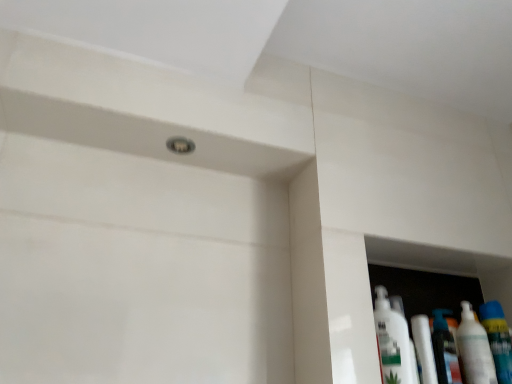
Question: Can you confirm if white glossy tube at lower right is bigger than white glossy bottle at right, the 2th cleaning product viewed from the left?

Choices:
 (A) yes
 (B) no

Answer: (B)

Question: Is white glossy tube at lower right not near white glossy bottle at right, the 2th cleaning product viewed from the left?

Choices:
 (A) no
 (B) yes

Answer: (A)

Question: Does white glossy tube at lower right have a greater height compared to white glossy bottle at right, the 2th cleaning product viewed from the left?

Choices:
 (A) no
 (B) yes

Answer: (A)

Question: From a real-world perspective, is white glossy tube at lower right physically above white glossy bottle at right, the 1th cleaning product when ordered from right to left?

Choices:
 (A) no
 (B) yes

Answer: (A)

Question: From the image's perspective, is white glossy tube at lower right above white glossy bottle at right, the 1th cleaning product when ordered from right to left?

Choices:
 (A) no
 (B) yes

Answer: (B)

Question: Visually, is white glossy bottle at right, the 1th cleaning product when ordered from right to left, positioned to the left or to the right of translucent plastic mouthwash at right, placed as the first mouthwash when sorted from right to left?

Choices:
 (A) right
 (B) left

Answer: (B)

Question: In terms of height, does white glossy bottle at right, the 2th cleaning product viewed from the left, look taller or shorter compared to translucent plastic mouthwash at right, placed as the first mouthwash when sorted from right to left?

Choices:
 (A) tall
 (B) short

Answer: (A)

Question: Is white glossy bottle at right, the 1th cleaning product when ordered from right to left, wider or thinner than translucent plastic mouthwash at right, placed as the first mouthwash when sorted from right to left?

Choices:
 (A) thin
 (B) wide

Answer: (A)

Question: From a real-world perspective, is white glossy bottle at right, the 2th cleaning product viewed from the left, physically located above or below translucent plastic mouthwash at right, placed as the first mouthwash when sorted from right to left?

Choices:
 (A) below
 (B) above

Answer: (A)

Question: In terms of width, does translucent plastic mouthwash at right, the second mouthwash positioned from the left, look wider or thinner when compared to white glossy tube at lower right?

Choices:
 (A) thin
 (B) wide

Answer: (B)

Question: From the image's perspective, is translucent plastic mouthwash at right, the second mouthwash positioned from the left, located above or below white glossy tube at lower right?

Choices:
 (A) below
 (B) above

Answer: (A)

Question: Is translucent plastic mouthwash at right, the second mouthwash positioned from the left, bigger or smaller than white glossy tube at lower right?

Choices:
 (A) big
 (B) small

Answer: (A)

Question: In the image, is translucent plastic mouthwash at right, the second mouthwash positioned from the left, positioned in front of or behind white glossy tube at lower right?

Choices:
 (A) front
 (B) behind

Answer: (B)

Question: From a real-world perspective, relative to white glossy bottle at right, the 2th cleaning product viewed from the left, is white glossy bottle at right, acting as the second mouthwash starting from the right, vertically above or below?

Choices:
 (A) below
 (B) above

Answer: (A)

Question: From the image's perspective, is white glossy bottle at right, which is the first mouthwash in left-to-right order, located above or below white glossy bottle at right, the 1th cleaning product when ordered from right to left?

Choices:
 (A) above
 (B) below

Answer: (B)